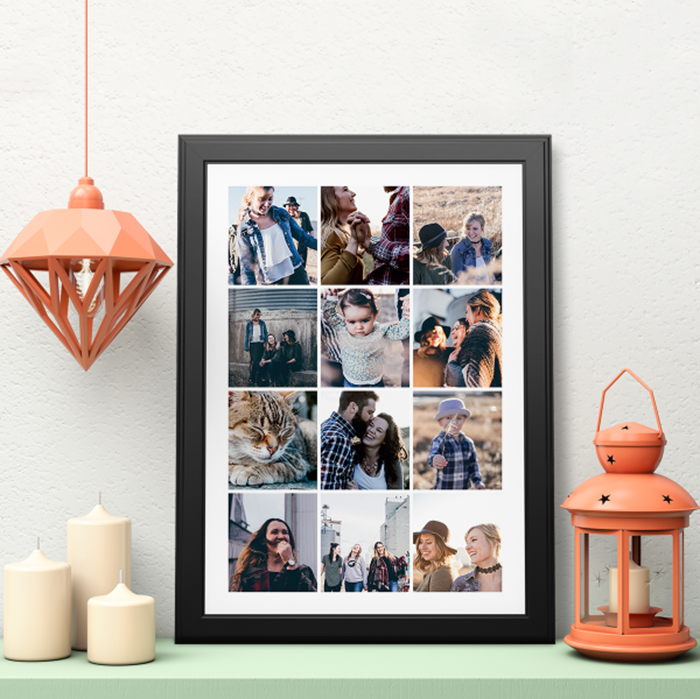
You are a GUI agent. You are given a task and a screenshot of the screen. Output one action in this format:
    pyautogui.click(x=<x>, y=<y>)
    Task: Click on the candles
    The height and width of the screenshot is (699, 700).
    Given the screenshot: What is the action you would take?
    pyautogui.click(x=47, y=593), pyautogui.click(x=90, y=563), pyautogui.click(x=132, y=637), pyautogui.click(x=636, y=590)